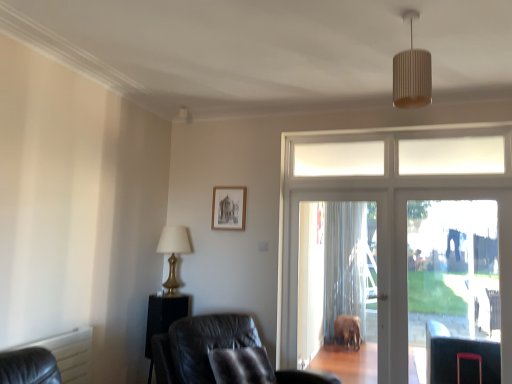
Question: Is translucent plastic screen door at center, acting as the 2th screen door starting from the right, turned away from white ribbed shade at upper center?

Choices:
 (A) no
 (B) yes

Answer: (A)

Question: Considering the relative sizes of translucent plastic screen door at center, acting as the first screen door starting from the left, and white ribbed shade at upper center in the image provided, is translucent plastic screen door at center, acting as the first screen door starting from the left, shorter than white ribbed shade at upper center?

Choices:
 (A) yes
 (B) no

Answer: (B)

Question: Does translucent plastic screen door at center, acting as the first screen door starting from the left, have a smaller size compared to white ribbed shade at upper center?

Choices:
 (A) no
 (B) yes

Answer: (A)

Question: Could white ribbed shade at upper center be considered to be inside translucent plastic screen door at center, acting as the 2th screen door starting from the right?

Choices:
 (A) yes
 (B) no

Answer: (B)

Question: Is the depth of translucent plastic screen door at center, acting as the first screen door starting from the left, less than that of white ribbed shade at upper center?

Choices:
 (A) yes
 (B) no

Answer: (B)

Question: Is translucent plastic screen door at center, acting as the first screen door starting from the left, located outside white ribbed shade at upper center?

Choices:
 (A) yes
 (B) no

Answer: (A)

Question: Does white glass door at center appear on the right side of gold metallic table lamp at left?

Choices:
 (A) yes
 (B) no

Answer: (A)

Question: Can you confirm if white glass door at center is wider than gold metallic table lamp at left?

Choices:
 (A) yes
 (B) no

Answer: (B)

Question: Is white glass door at center far from gold metallic table lamp at left?

Choices:
 (A) no
 (B) yes

Answer: (B)

Question: Can we say white glass door at center lies outside gold metallic table lamp at left?

Choices:
 (A) yes
 (B) no

Answer: (A)

Question: From a real-world perspective, is white glass door at center located beneath gold metallic table lamp at left?

Choices:
 (A) no
 (B) yes

Answer: (A)

Question: Is white glass door at center behind gold metallic table lamp at left?

Choices:
 (A) yes
 (B) no

Answer: (B)

Question: Considering the relative positions of white glass door at center and black leather side table at lower left in the image provided, is white glass door at center to the left of black leather side table at lower left from the viewer's perspective?

Choices:
 (A) no
 (B) yes

Answer: (A)